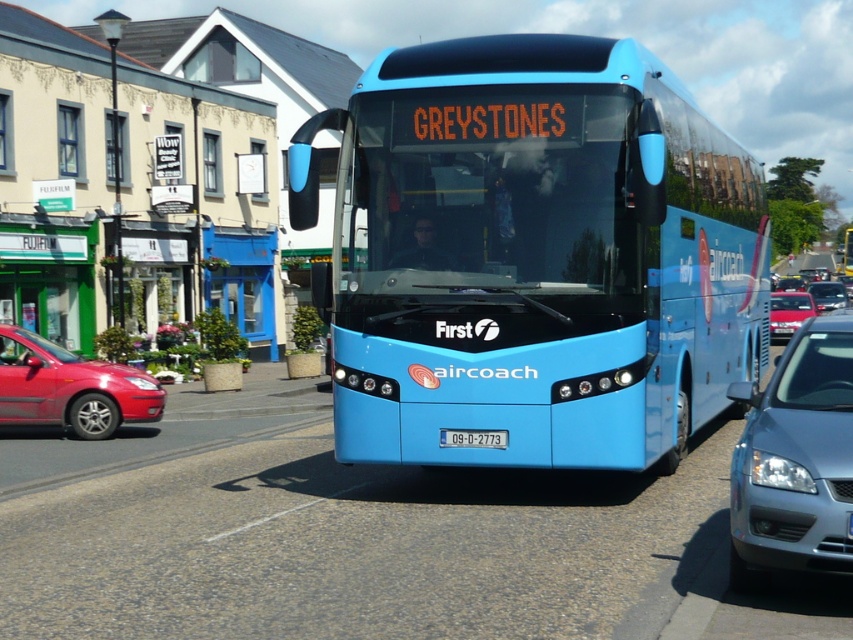
Question: Does white plastic license plate at center appear over metallic silver car at center?

Choices:
 (A) no
 (B) yes

Answer: (A)

Question: Which point is closer to the camera taking this photo?

Choices:
 (A) (445, 435)
 (B) (33, 227)
 (C) (798, 323)
 (D) (4, 364)

Answer: (A)

Question: Estimate the real-world distances between objects in this image. Which object is closer to the matte blue bus at center?

Choices:
 (A) satin silver sedan at center
 (B) metallic silver car at center

Answer: (A)

Question: Where is metallic red sedan at left located in relation to metallic silver sedan at right in the image?

Choices:
 (A) right
 (B) left

Answer: (B)

Question: Which point is closer to the camera?

Choices:
 (A) (22, 380)
 (B) (827, 288)
 (C) (492, 305)

Answer: (C)

Question: Can you confirm if blue glossy bus at center is positioned below metallic silver car at center?

Choices:
 (A) no
 (B) yes

Answer: (A)